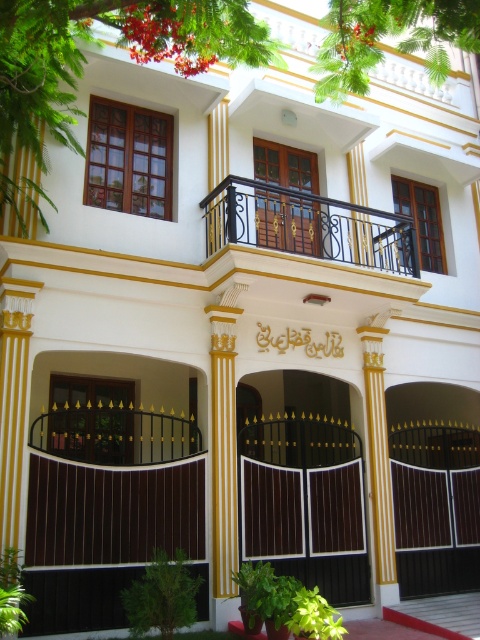
Question: Can you confirm if dark brown wooden gate at center is bigger than wooden door at center?

Choices:
 (A) yes
 (B) no

Answer: (A)

Question: Among these objects, which one is farthest from the camera?

Choices:
 (A) wooden door at center
 (B) yellow painted wood column at center
 (C) black wrought iron balcony at upper center

Answer: (A)

Question: Which point is closer to the camera?

Choices:
 (A) black wrought iron balcony at upper center
 (B) dark brown wooden gate at center
 (C) yellow painted wood column at center

Answer: (A)

Question: Does black wrought iron balcony at upper center have a larger size compared to wooden door at center?

Choices:
 (A) no
 (B) yes

Answer: (B)

Question: Does wooden door at center lie in front of yellow painted wood column at center?

Choices:
 (A) yes
 (B) no

Answer: (B)

Question: Among these points, which one is nearest to the camera?

Choices:
 (A) (267, 244)
 (B) (343, 237)
 (C) (296, 452)

Answer: (A)